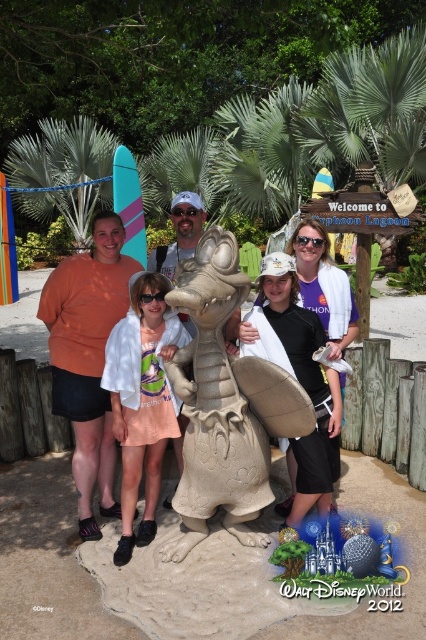
You are a photographer who needs to capture a group photo of the beige textured sand sculpture at center and the matte sand sculpture of dragon at center. The camera you are using has a maximum focus range of 1.0 meters. Can you fit both sculptures into the frame without moving the camera?

The beige textured sand sculpture at center and the matte sand sculpture of dragon at center are 1.04 meters apart from each other. Since the camera can only focus up to 1.0 meters, you cannot fit both sculptures into the frame without moving the camera.

You are a photographer trying to capture a clear shot of the white cotton shirt at center without the beige textured sand sculpture at center blocking it. What should you do?

Move your position so that the white cotton shirt at center is no longer behind the beige textured sand sculpture at center. Since the beige textured sand sculpture at center is in front of the white cotton shirt at center, moving around the sculpture would allow you to see the shirt without obstruction.